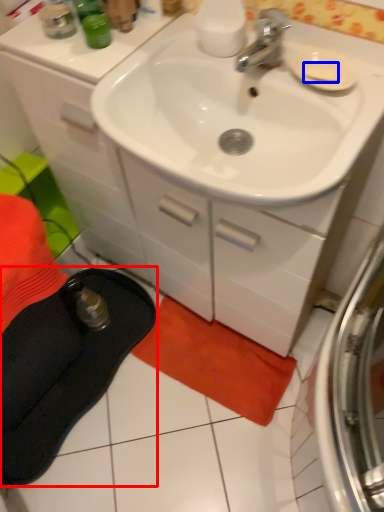
Question: Which point is closer to the camera, slipper (highlighted by a red box) or soap (highlighted by a blue box)?

Choices:
 (A) slipper
 (B) soap

Answer: (B)